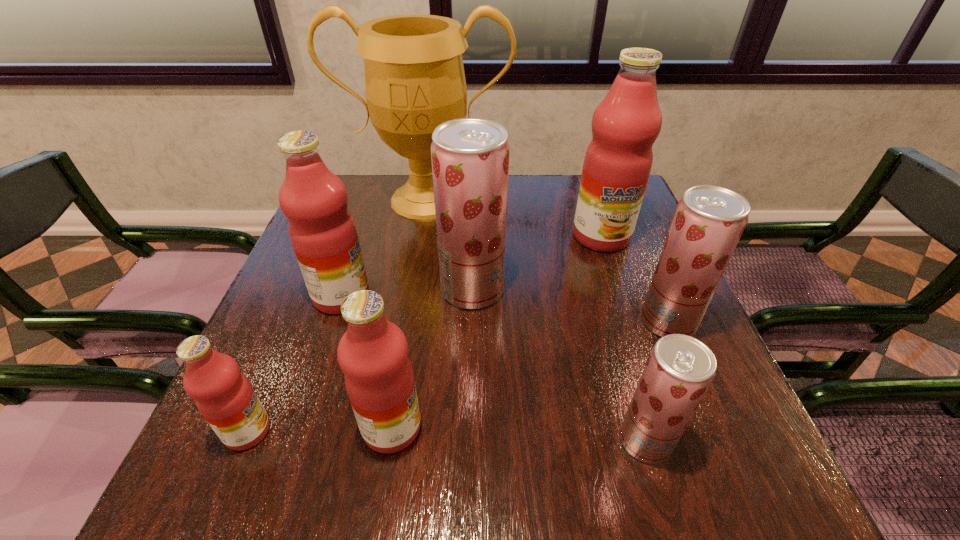
The width and height of the screenshot is (960, 540). Identify the location of trophy. (414, 75).

The width and height of the screenshot is (960, 540). Find the location of `the rightmost pink fruit juice`. the rightmost pink fruit juice is located at coordinates (617, 164).

Locate an element on the screen. the biggest pink fruit juice is located at coordinates (617, 164).

Locate an element on the screen. the fourth fruit juice from left to right is located at coordinates (470, 156).

This screenshot has width=960, height=540. I want to click on the leftmost strawberry fruit juice, so click(470, 156).

The image size is (960, 540). What are the coordinates of `the second biggest pink fruit juice` in the screenshot? It's located at (x=322, y=231).

Identify the location of the rightmost strawberry fruit juice. (709, 220).

Where is `the fifth fruit juice from right to left`? This screenshot has height=540, width=960. the fifth fruit juice from right to left is located at coordinates (373, 353).

Locate an element on the screen. the second pink fruit juice from right to left is located at coordinates (373, 353).

You are a GUI agent. You are given a task and a screenshot of the screen. Output one action in this format:
    pyautogui.click(x=<x>, y=<y>)
    Task: Click on the smallest pink fruit juice
    This screenshot has height=540, width=960.
    Given the screenshot: What is the action you would take?
    point(223,395)